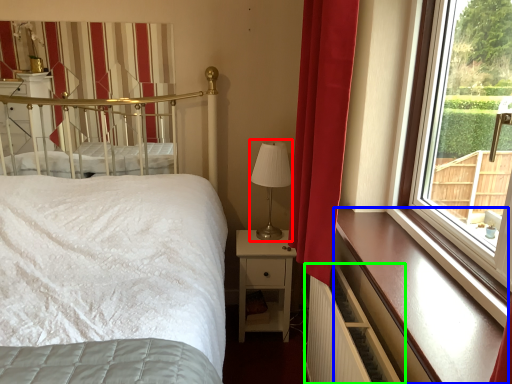
Question: Estimate the real-world distances between objects in this image. Which object is closer to table lamp (highlighted by a red box), ledge (highlighted by a blue box) or balustrade (highlighted by a green box)?

Choices:
 (A) ledge
 (B) balustrade

Answer: (B)